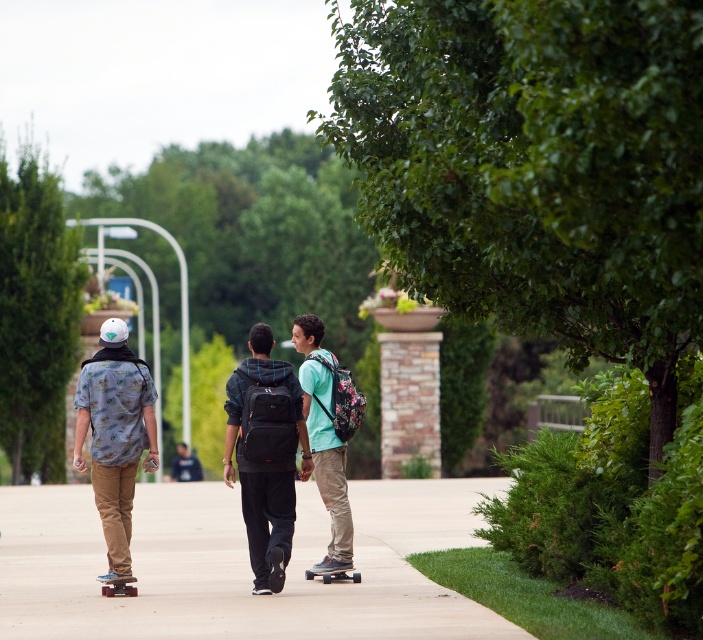
You are a photographer standing at the starting point of the pathway. You want to take a photo of the matte black skateboard at center. Where should you position yourself to capture it in the frame?

To capture the matte black skateboard at center in the frame, position yourself at the starting point of the pathway and aim towards the coordinates where the skateboard is located at point (264, 454).